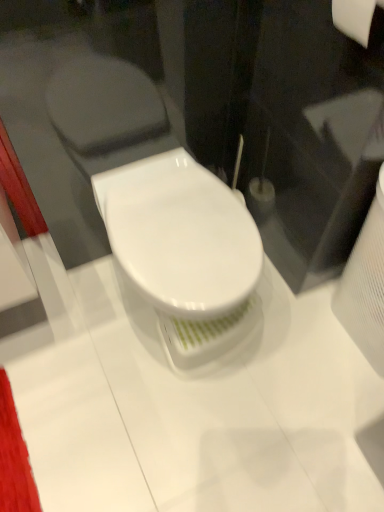
Question: From the image's perspective, does white matte toilet paper at upper right appear lower than white glossy toilet at center?

Choices:
 (A) no
 (B) yes

Answer: (A)

Question: Is white matte toilet paper at upper right aimed at white glossy toilet at center?

Choices:
 (A) no
 (B) yes

Answer: (A)

Question: Does white matte toilet paper at upper right have a larger size compared to white glossy toilet at center?

Choices:
 (A) no
 (B) yes

Answer: (A)

Question: Is the position of white matte toilet paper at upper right more distant than that of white glossy toilet at center?

Choices:
 (A) no
 (B) yes

Answer: (A)

Question: Is white matte toilet paper at upper right completely or partially outside of white glossy toilet at center?

Choices:
 (A) no
 (B) yes

Answer: (B)

Question: Can you confirm if white matte toilet paper at upper right is wider than white glossy toilet at center?

Choices:
 (A) yes
 (B) no

Answer: (B)

Question: From the image's perspective, does white glossy toilet at center appear higher than white matte toilet paper at upper right?

Choices:
 (A) yes
 (B) no

Answer: (B)

Question: Is white glossy toilet at center directly adjacent to white matte toilet paper at upper right?

Choices:
 (A) no
 (B) yes

Answer: (A)

Question: Is white glossy toilet at center at the right side of white matte toilet paper at upper right?

Choices:
 (A) no
 (B) yes

Answer: (A)

Question: Is white glossy toilet at center behind white matte toilet paper at upper right?

Choices:
 (A) yes
 (B) no

Answer: (A)

Question: Considering the relative sizes of white glossy toilet at center and white matte toilet paper at upper right in the image provided, is white glossy toilet at center thinner than white matte toilet paper at upper right?

Choices:
 (A) yes
 (B) no

Answer: (B)

Question: From a real-world perspective, does white glossy toilet at center stand above white matte toilet paper at upper right?

Choices:
 (A) yes
 (B) no

Answer: (B)

Question: From a real-world perspective, is white glossy toilet at center physically located above or below white matte toilet paper at upper right?

Choices:
 (A) below
 (B) above

Answer: (A)